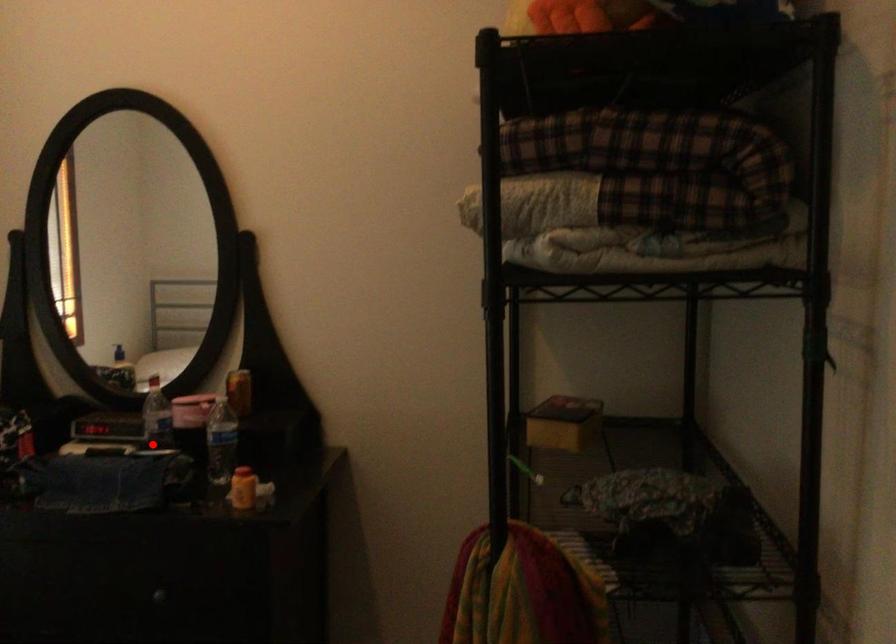
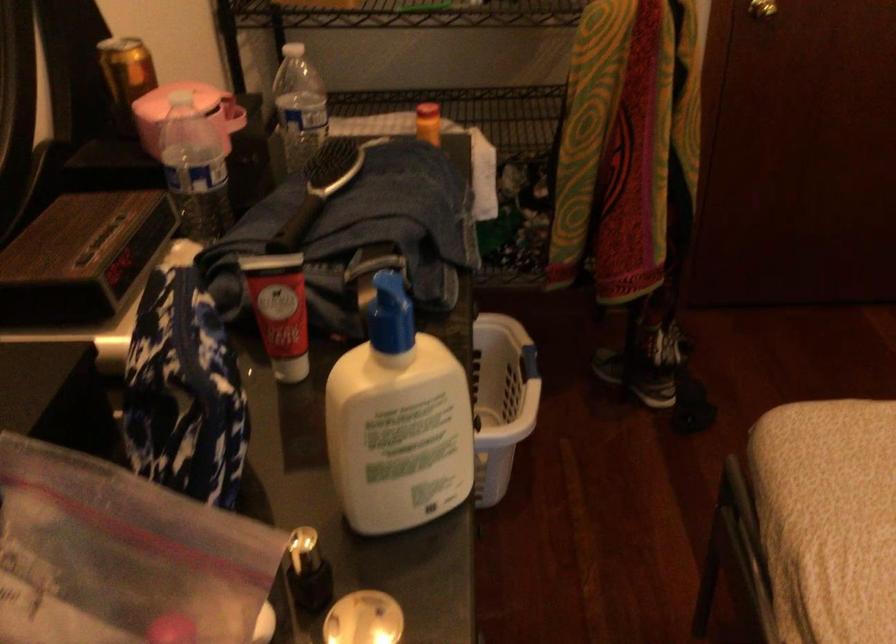
Question: I am providing you with two images of the same scene from different viewpoints. Image1 has a red point marked. In image2, the corresponding 3D location appears at what relative position? Reply with the corresponding letter.

Choices:
 (A) Closer
 (B) Farther

Answer: (A)